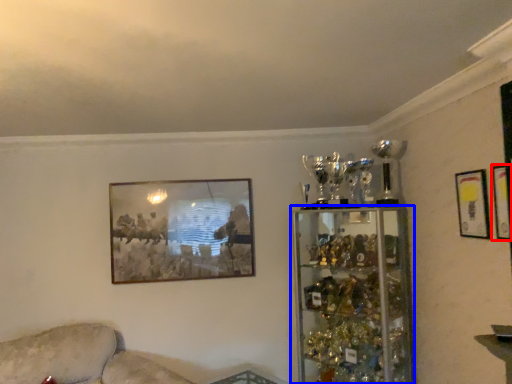
Question: Among these objects, which one is farthest to the camera, picture frame (highlighted by a red box) or shelf (highlighted by a blue box)?

Choices:
 (A) picture frame
 (B) shelf

Answer: (B)